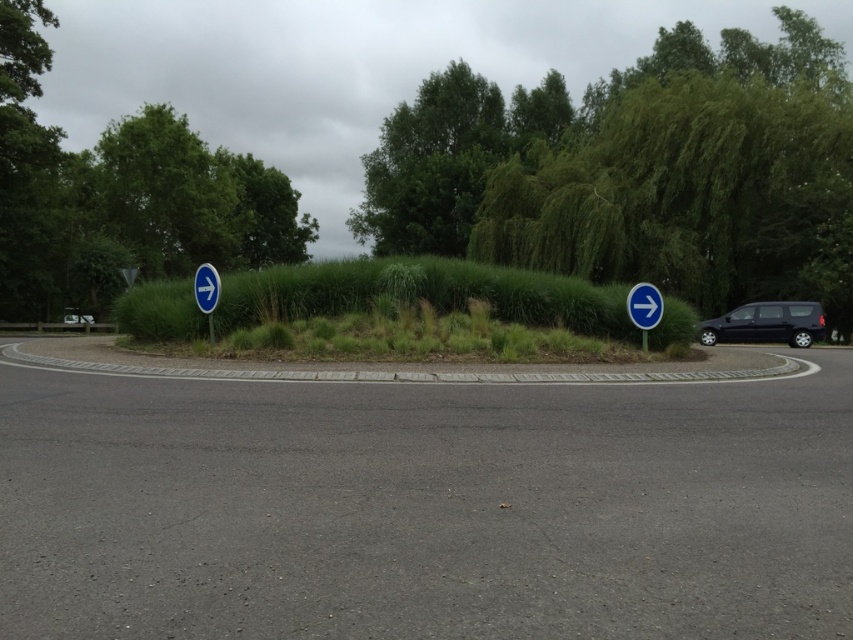
You are a delivery driver who needs to park your truck near the roundabout. Your truck is 8 meters long. You spot the green grassy hedge at center and the blue plastic signpost at left. Can you park your truck between these two objects without overlapping them?

The distance between the green grassy hedge at center and the blue plastic signpost at left is 7.93 meters. Since your truck is 8 meters long, it would be 0.07 meters too long to fit between them without overlapping. Therefore, you cannot park your truck between these two objects.

You are a delivery driver approaching the roundabout and need to choose between the blue plastic sign at left and the blue plastic signpost at right. Which one is taller?

The blue plastic sign at left is much taller than the blue plastic signpost at right.